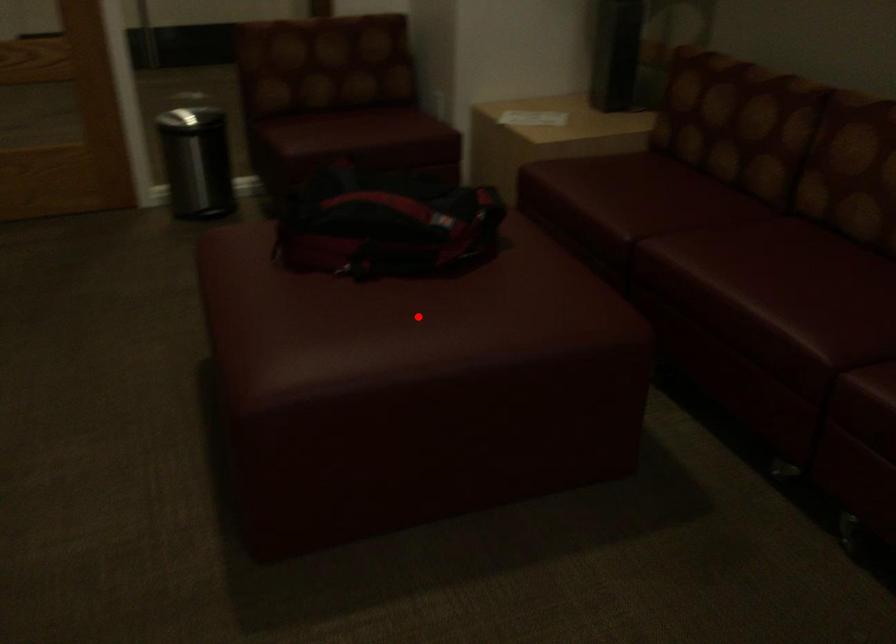
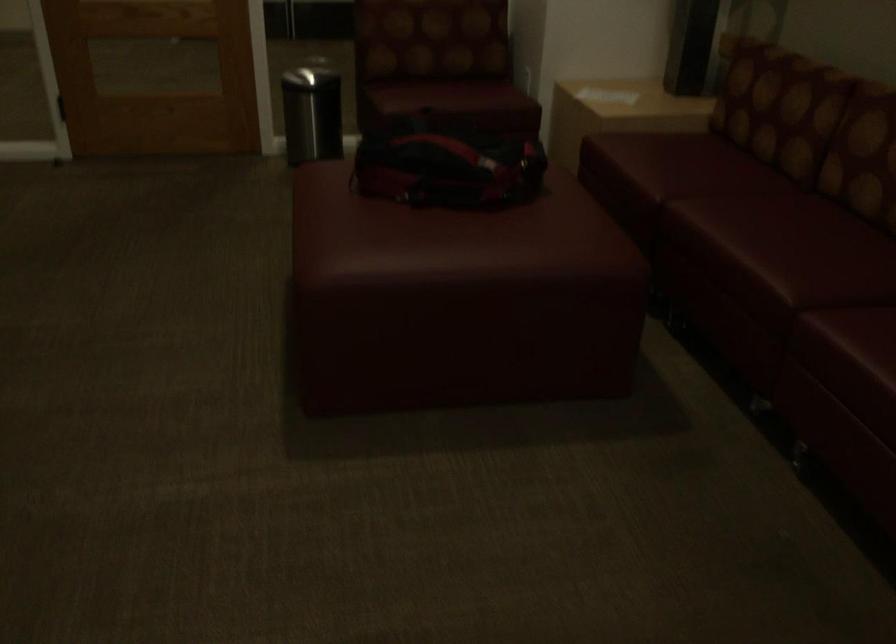
Find the pixel in the second image that matches the highlighted location in the first image.

(451, 237)